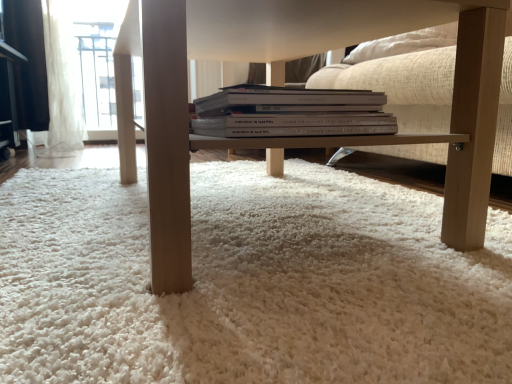
Question: Is light wood table at center wider than white sheer curtain at upper left?

Choices:
 (A) yes
 (B) no

Answer: (A)

Question: Is light wood table at center to the left of white sheer curtain at upper left from the viewer's perspective?

Choices:
 (A) no
 (B) yes

Answer: (A)

Question: Is light wood table at center not inside white sheer curtain at upper left?

Choices:
 (A) no
 (B) yes

Answer: (B)

Question: Is the position of light wood table at center less distant than that of white sheer curtain at upper left?

Choices:
 (A) no
 (B) yes

Answer: (B)

Question: Is light wood table at center smaller than white sheer curtain at upper left?

Choices:
 (A) no
 (B) yes

Answer: (A)

Question: Considering the relative sizes of light wood table at center and white sheer curtain at upper left in the image provided, is light wood table at center thinner than white sheer curtain at upper left?

Choices:
 (A) no
 (B) yes

Answer: (A)

Question: Would you say white fluffy carpet at center is outside white sheer curtain at upper left?

Choices:
 (A) yes
 (B) no

Answer: (A)

Question: Can you confirm if white fluffy carpet at center is taller than white sheer curtain at upper left?

Choices:
 (A) yes
 (B) no

Answer: (B)

Question: Could white sheer curtain at upper left be considered to be inside white fluffy carpet at center?

Choices:
 (A) yes
 (B) no

Answer: (B)

Question: From a real-world perspective, is white fluffy carpet at center beneath white sheer curtain at upper left?

Choices:
 (A) no
 (B) yes

Answer: (B)

Question: Considering the relative sizes of white fluffy carpet at center and white sheer curtain at upper left in the image provided, is white fluffy carpet at center smaller than white sheer curtain at upper left?

Choices:
 (A) no
 (B) yes

Answer: (A)

Question: Considering the relative sizes of white fluffy carpet at center and white sheer curtain at upper left in the image provided, is white fluffy carpet at center shorter than white sheer curtain at upper left?

Choices:
 (A) yes
 (B) no

Answer: (A)

Question: Would you say white sheer curtain at upper left contains white paper book at center?

Choices:
 (A) no
 (B) yes

Answer: (A)